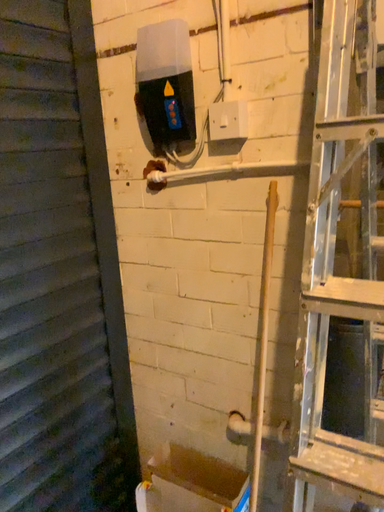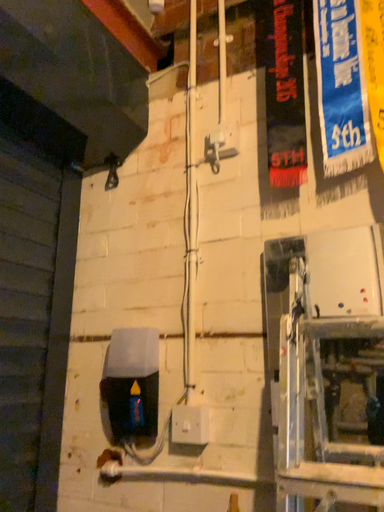
Question: Which way did the camera rotate in the video?

Choices:
 (A) rotated left
 (B) rotated right

Answer: (B)